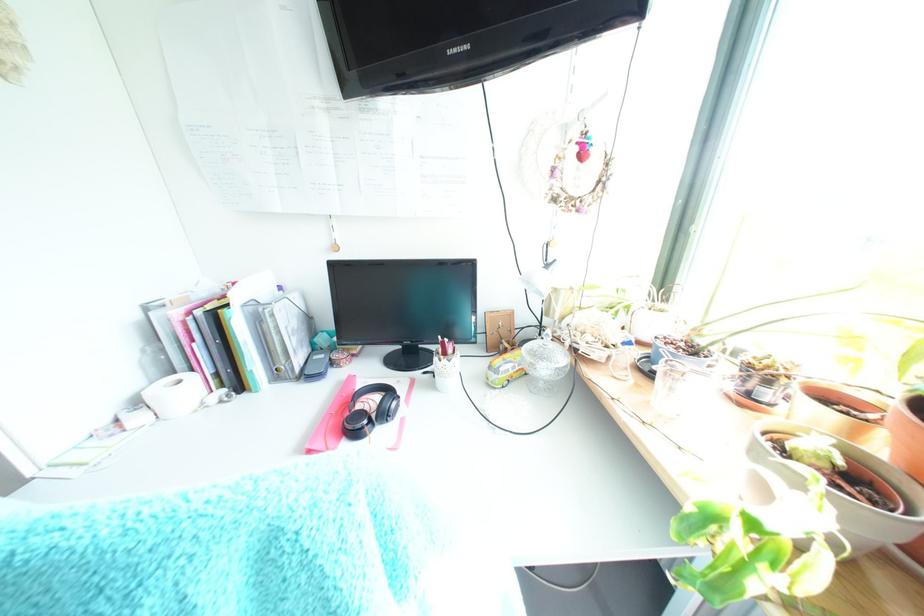
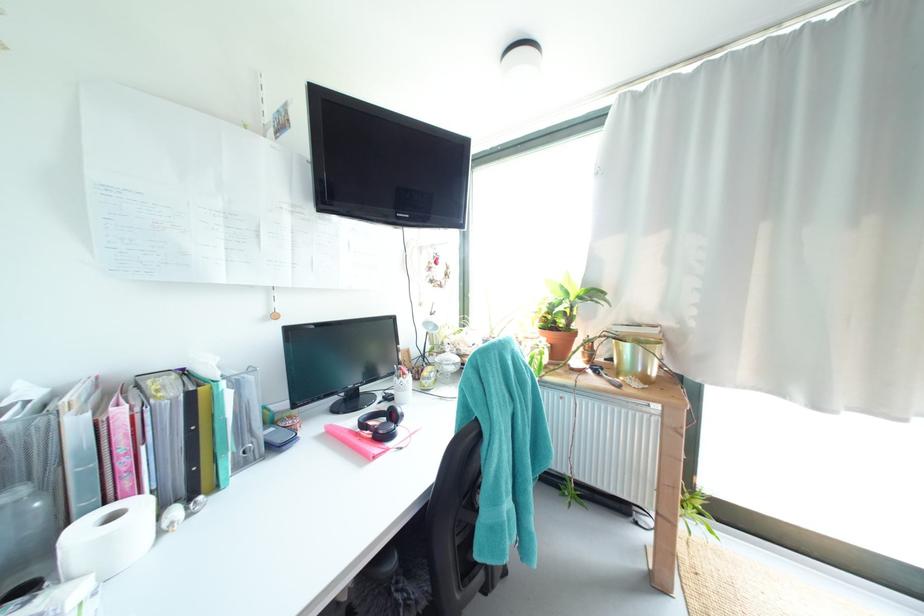
Find the pixel in the second image that matches (187,384) in the first image.

(120, 517)